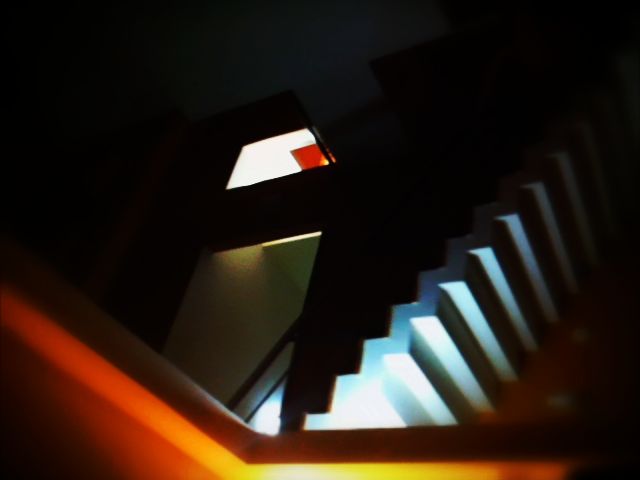
Identify the location of beige wall. (236, 310).